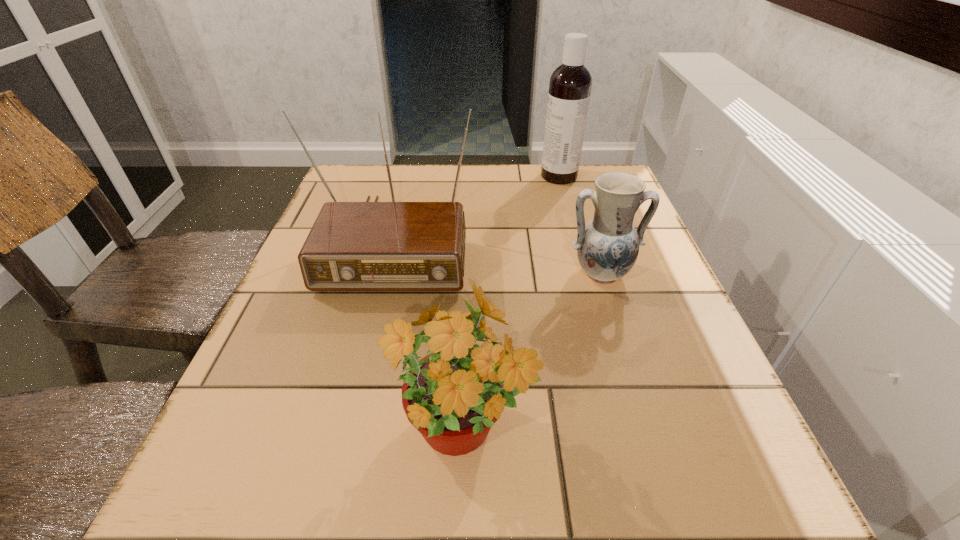
What are the coordinates of `dishwasher detergent` in the screenshot? It's located at (570, 84).

The image size is (960, 540). Identify the location of the tallest object. (570, 84).

Where is `radio_receiver`? This screenshot has height=540, width=960. radio_receiver is located at coordinates (352, 246).

Locate an element on the screen. The height and width of the screenshot is (540, 960). the nearest object is located at coordinates (467, 379).

The height and width of the screenshot is (540, 960). What are the coordinates of `the shortest object` in the screenshot? It's located at (607, 247).

Identify the location of free spot located on the label side of the tallest object. point(471,176).

At what (x,y) coordinates should I click in order to perform the action: click on vacant space located on the label side of the tallest object. Please return your answer as a coordinate pair (x, y). The width and height of the screenshot is (960, 540). Looking at the image, I should click on (461, 176).

This screenshot has width=960, height=540. I want to click on vacant region located 0.370m on the label side of the tallest object, so click(x=406, y=176).

Locate an element on the screen. This screenshot has height=540, width=960. vacant area situated 0.080m on the front panel of the radio_receiver is located at coordinates (373, 326).

Locate an element on the screen. This screenshot has height=540, width=960. free region located on the back of the nearest object is located at coordinates (468, 265).